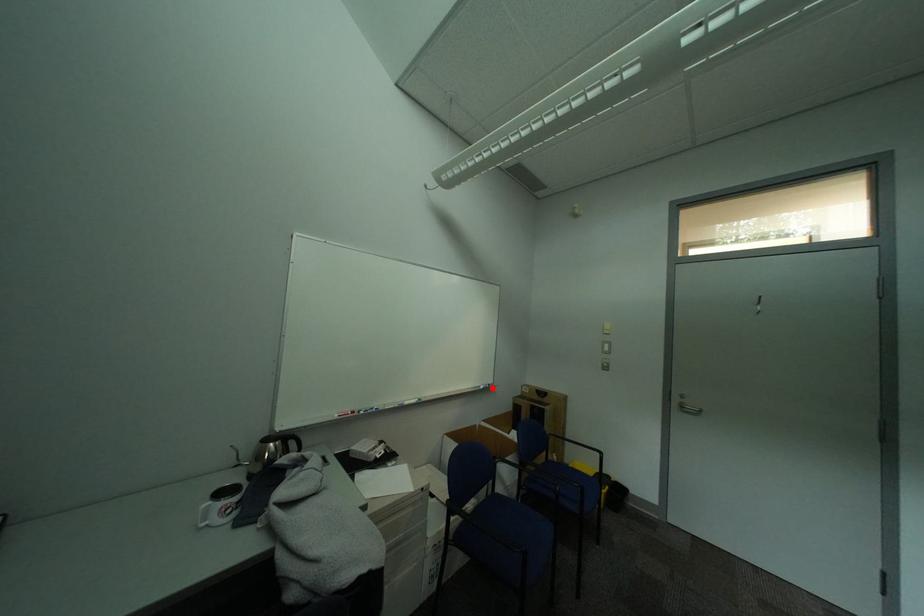
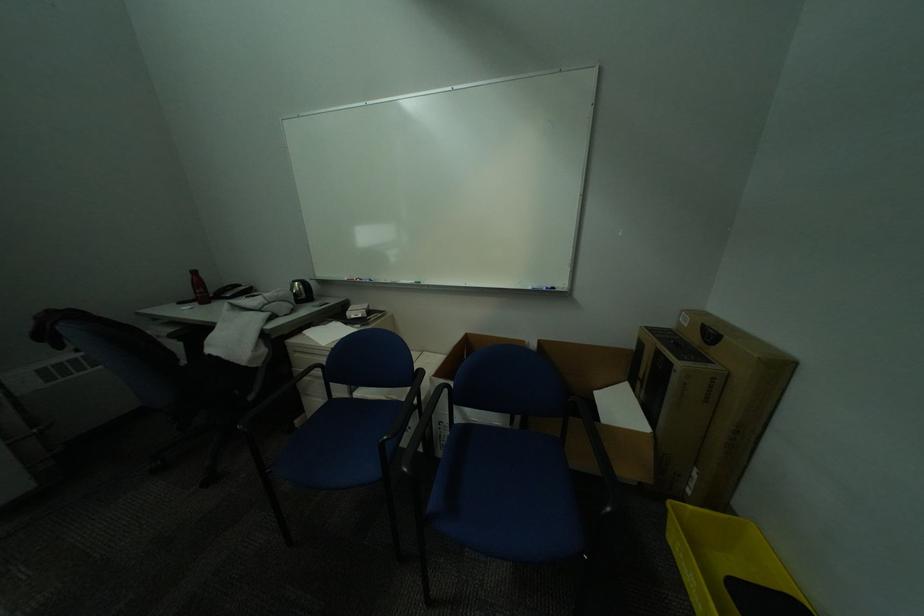
Locate, in the second image, the point that corresponds to the highlighted location in the first image.

(541, 289)